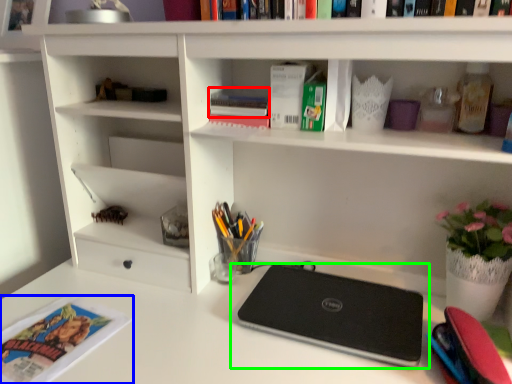
Question: Based on their relative distances, which object is farther from book (highlighted by a red box)? Choose from magazine (highlighted by a blue box) and laptop (highlighted by a green box).

Choices:
 (A) magazine
 (B) laptop

Answer: (A)